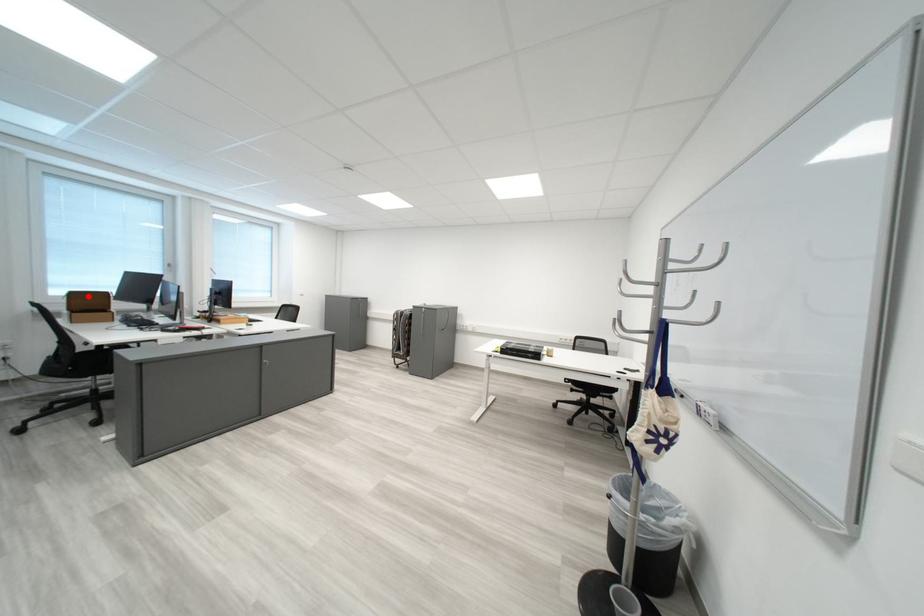
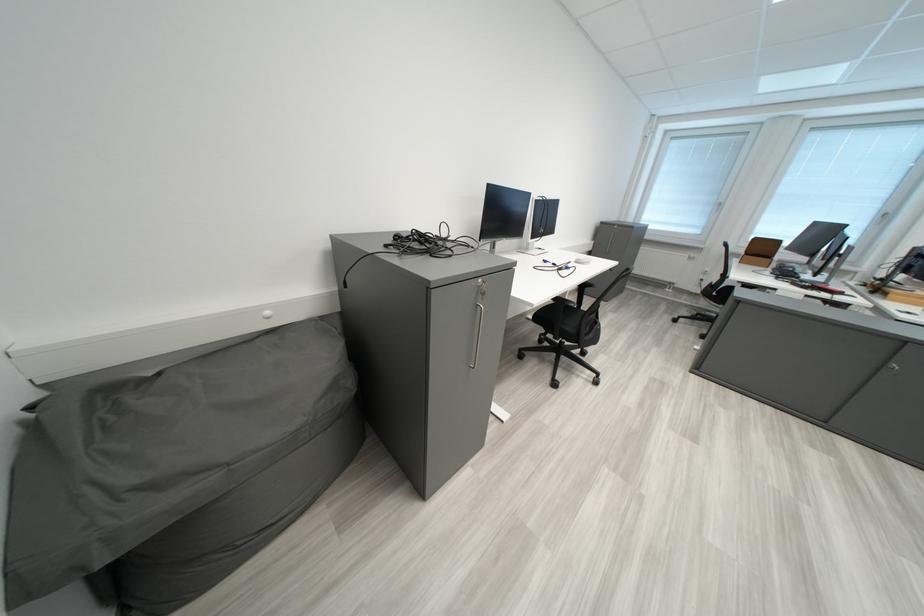
Find the pixel in the second image that matches the highlighted location in the first image.

(769, 241)